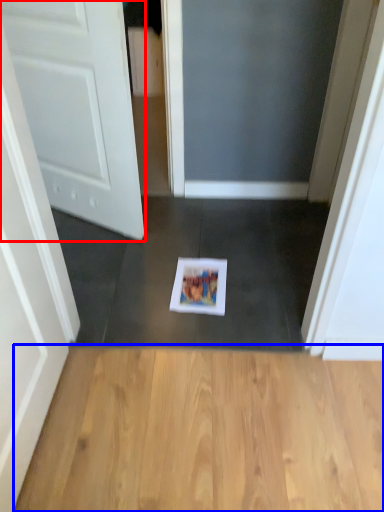
Question: Which of the following is the farthest to the observer, door (highlighted by a red box) or hardwood (highlighted by a blue box)?

Choices:
 (A) door
 (B) hardwood

Answer: (A)